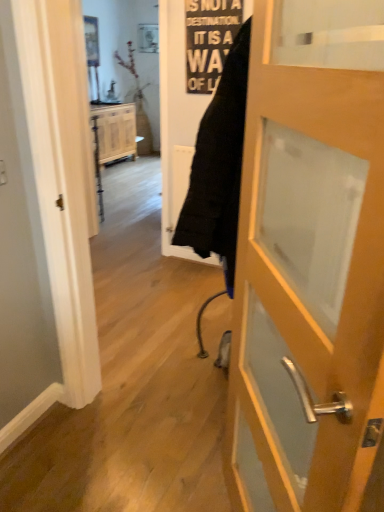
At what (x,y) coordinates should I click in order to perform the action: click on wooden cabinet at center. Please return your answer as a coordinate pair (x, y). This screenshot has width=384, height=512. Looking at the image, I should click on (115, 131).

This screenshot has width=384, height=512. Find the location of `black paper sign at upper center`. black paper sign at upper center is located at coordinates (209, 40).

Find the location of `wooden cabinet at center`. wooden cabinet at center is located at coordinates (115, 131).

Is wooden door at center inside the boundaries of black paper sign at upper center, or outside?

wooden door at center is not enclosed by black paper sign at upper center.

Considering the positions of objects wooden door at center and black paper sign at upper center in the image provided, who is more to the right, wooden door at center or black paper sign at upper center?

wooden door at center is more to the right.

Between wooden door at center and black paper sign at upper center, which one is positioned behind?

black paper sign at upper center is more distant.

From the image's perspective, is wooden cabinet at center beneath black paper sign at upper center?

No, from the image's perspective, wooden cabinet at center is not below black paper sign at upper center.

Considering the points (102, 135) and (213, 37), which point is in front, point (102, 135) or point (213, 37)?

The point (213, 37) is in front.

Is wooden cabinet at center outside of black paper sign at upper center?

Yes, wooden cabinet at center is outside of black paper sign at upper center.

Between point (229, 24) and point (255, 124), which one is positioned behind?

The point (229, 24) is behind.

How distant is black paper sign at upper center from wooden door at center?

black paper sign at upper center is 6.98 feet from wooden door at center.

This screenshot has height=512, width=384. I want to click on door below the black paper sign at upper center (from the image's perspective), so click(310, 260).

Is black paper sign at upper center looking in the opposite direction of wooden door at center?

No, black paper sign at upper center's orientation is not away from wooden door at center.

Considering the sizes of black paper sign at upper center and wooden cabinet at center in the image, is black paper sign at upper center bigger or smaller than wooden cabinet at center?

Considering their sizes, black paper sign at upper center takes up less space than wooden cabinet at center.

How many degrees apart are the facing directions of black paper sign at upper center and wooden cabinet at center?

They differ by 62.2 degrees in their facing directions.

Considering the sizes of objects black paper sign at upper center and wooden cabinet at center in the image provided, who is wider, black paper sign at upper center or wooden cabinet at center?

wooden cabinet at center is wider.

Could you tell me if black paper sign at upper center is turned towards wooden cabinet at center?

No, black paper sign at upper center is not oriented towards wooden cabinet at center.

Does wooden door at center have a lesser width compared to wooden cabinet at center?

Correct, the width of wooden door at center is less than that of wooden cabinet at center.

This screenshot has width=384, height=512. I want to click on door in front of the wooden cabinet at center, so click(310, 260).

Does wooden door at center come in front of wooden cabinet at center?

Yes, the depth of wooden door at center is less than that of wooden cabinet at center.

From the image's perspective, is wooden cabinet at center below wooden door at center?

No, from the image's perspective, wooden cabinet at center is not beneath wooden door at center.

Which object is positioned more to the right, wooden cabinet at center or wooden door at center?

wooden door at center is more to the right.

Consider the image. How many degrees apart are the facing directions of wooden cabinet at center and wooden door at center?

The angular difference between wooden cabinet at center and wooden door at center is 118 degrees.

Consider the image. Relative to wooden door at center, is wooden cabinet at center in front or behind?

In the image, wooden cabinet at center appears behind wooden door at center.

Image resolution: width=384 pixels, height=512 pixels. Find the location of `door that is below the black paper sign at upper center (from the image's perspective)`. door that is below the black paper sign at upper center (from the image's perspective) is located at coordinates (310, 260).

At what (x,y) coordinates should I click in order to perform the action: click on writing in front of the wooden cabinet at center. Please return your answer as a coordinate pair (x, y). This screenshot has height=512, width=384. Looking at the image, I should click on (209, 40).

Looking at the image, which one is located closer to wooden cabinet at center, black paper sign at upper center or wooden door at center?

black paper sign at upper center.

From the image, which object appears to be farther from wooden door at center, black paper sign at upper center or wooden cabinet at center?

wooden cabinet at center lies further to wooden door at center than the other object.

Looking at the image, which one is located closer to black paper sign at upper center, wooden cabinet at center or wooden door at center?

Based on the image, wooden door at center appears to be nearer to black paper sign at upper center.

When comparing their distances from black paper sign at upper center, does wooden door at center or wooden cabinet at center seem closer?

wooden door at center lies closer to black paper sign at upper center than the other object.

When comparing their distances from wooden cabinet at center, does wooden door at center or black paper sign at upper center seem closer?

black paper sign at upper center.

Considering their positions, is wooden cabinet at center positioned further to wooden door at center than black paper sign at upper center?

The object further to wooden door at center is wooden cabinet at center.

This screenshot has width=384, height=512. Identify the location of writing located between wooden door at center and wooden cabinet at center in the depth direction. (209, 40).